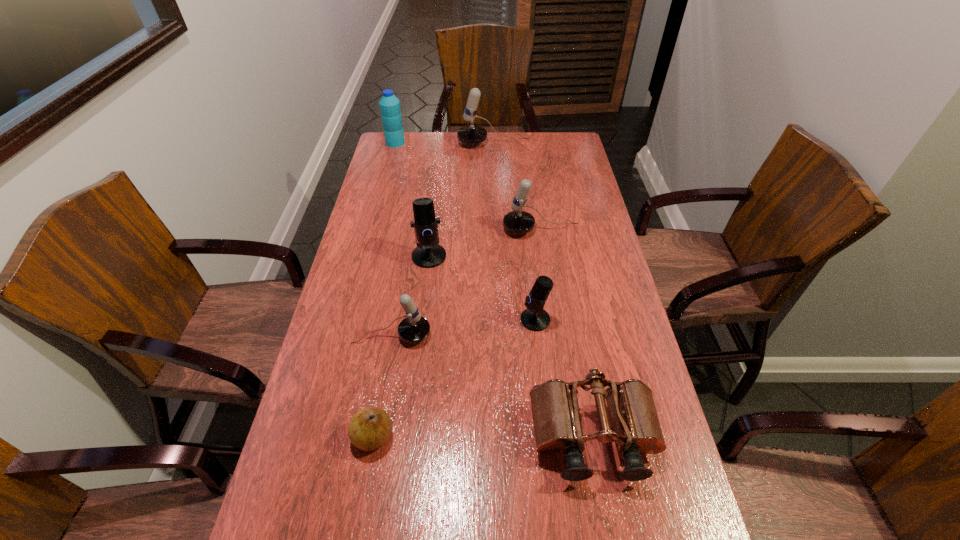
Where is `empty location between the biggest white microphone and the brown pear`? The width and height of the screenshot is (960, 540). empty location between the biggest white microphone and the brown pear is located at coordinates (x=434, y=290).

Select which object is the fifth closest to the smallest white microphone. Please provide its 2D coordinates. Your answer should be formatted as a tuple, i.e. [(x, y)], where the tuple contains the x and y coordinates of a point satisfying the conditions above.

[(517, 221)]

Identify the location of the sixth closest object to the nearer black microphone. This screenshot has height=540, width=960. (471, 134).

Choose which microphone is the third nearest neighbor to the nearest white microphone. Please provide its 2D coordinates. Your answer should be formatted as a tuple, i.e. [(x, y)], where the tuple contains the x and y coordinates of a point satisfying the conditions above.

[(517, 221)]

You are a GUI agent. You are given a task and a screenshot of the screen. Output one action in this format:
    pyautogui.click(x=<x>, y=<y>)
    Task: Click on the fifth closest microphone relative to the brown pear
    This screenshot has height=540, width=960.
    Given the screenshot: What is the action you would take?
    pyautogui.click(x=471, y=134)

Select which white microphone is the closest to the right black microphone. Please provide its 2D coordinates. Your answer should be formatted as a tuple, i.e. [(x, y)], where the tuple contains the x and y coordinates of a point satisfying the conditions above.

[(414, 328)]

Locate which white microphone is the third closest to the water bottle. Please provide its 2D coordinates. Your answer should be formatted as a tuple, i.e. [(x, y)], where the tuple contains the x and y coordinates of a point satisfying the conditions above.

[(414, 328)]